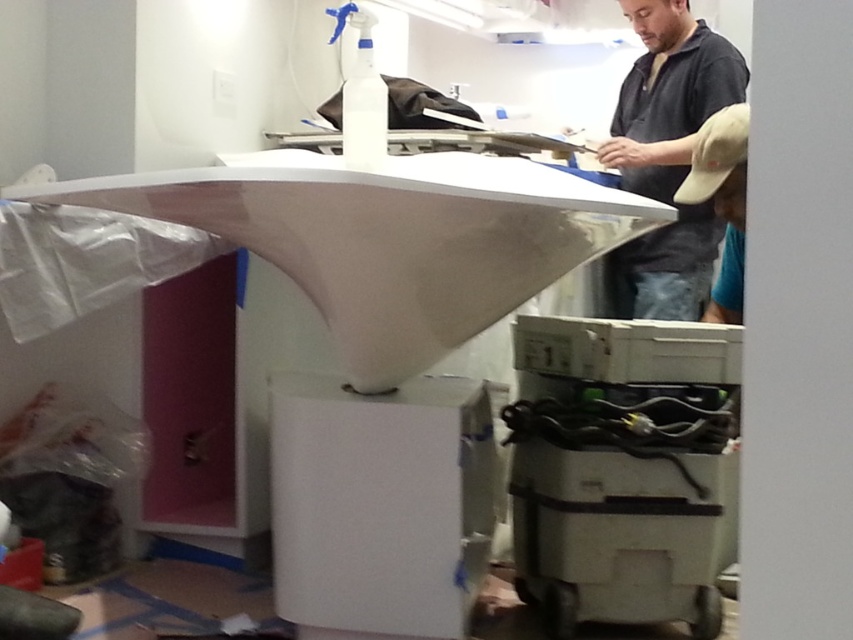
Question: Among these points, which one is nearest to the camera?

Choices:
 (A) (624, 214)
 (B) (703, 461)

Answer: (A)

Question: Considering the real-world distances, which object is closest to the matte black shirt at upper center?

Choices:
 (A) khaki fabric cap at right
 (B) white glossy exhaust hood at center

Answer: (A)

Question: Is the position of matte black shirt at upper center less distant than that of khaki fabric cap at right?

Choices:
 (A) yes
 (B) no

Answer: (B)

Question: Which point is farther to the camera?

Choices:
 (A) matte black shirt at upper center
 (B) white glossy exhaust hood at center
 (C) white plastic printer at lower right

Answer: (A)

Question: Is white glossy exhaust hood at center to the left of matte black shirt at upper center from the viewer's perspective?

Choices:
 (A) yes
 (B) no

Answer: (A)

Question: Does matte black shirt at upper center have a greater width compared to khaki fabric cap at right?

Choices:
 (A) yes
 (B) no

Answer: (A)